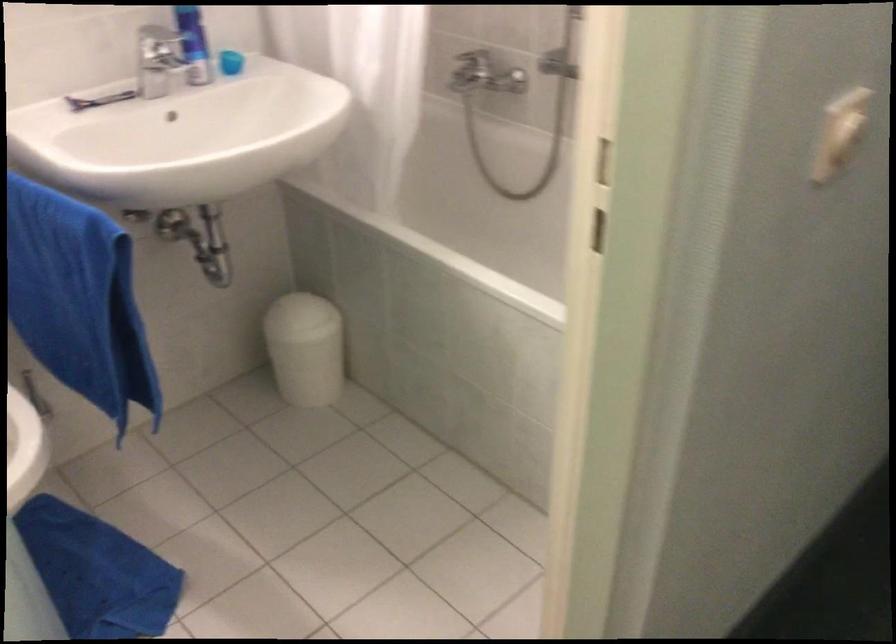
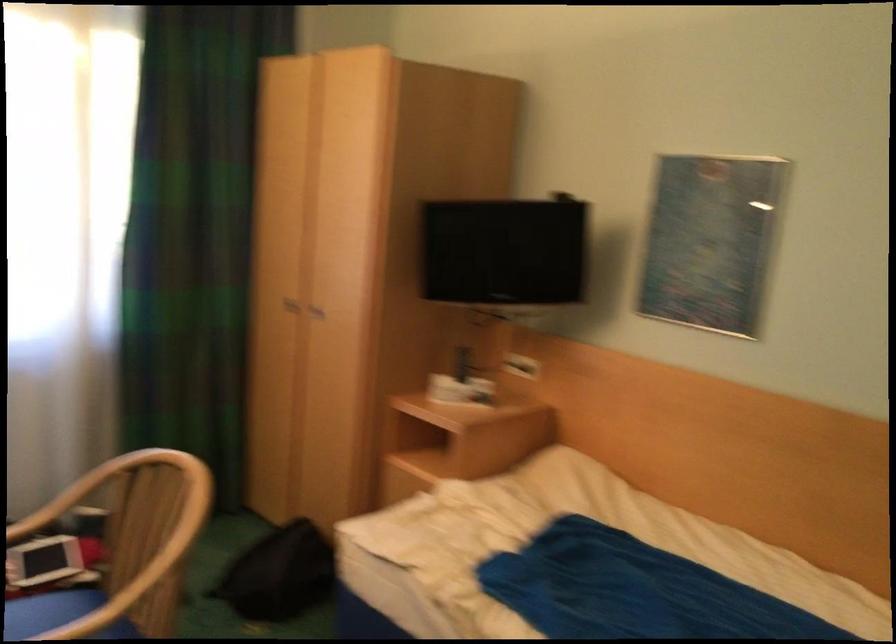
Question: Based on the continuous images, in which direction is the camera rotating? Reply with the corresponding letter.

Choices:
 (A) Left
 (B) Right
 (C) Up
 (D) Down

Answer: (A)